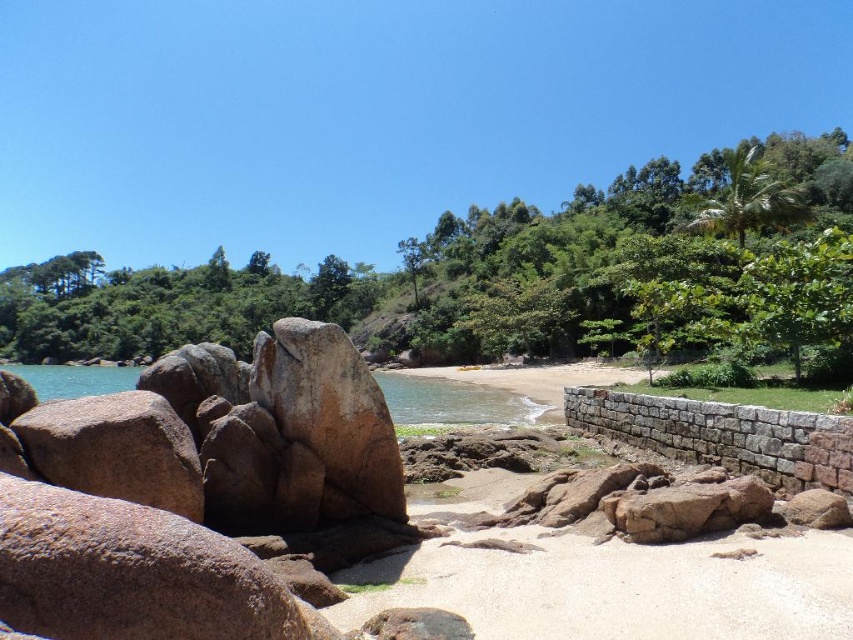
Does brown granite rock formation at center appear on the right side of clear blue water at center left?

Correct, you'll find brown granite rock formation at center to the right of clear blue water at center left.

Which of these two, brown granite rock formation at center or clear blue water at center left, stands shorter?

With less height is brown granite rock formation at center.

Who is more distant from viewer, (322, 504) or (129, 374)?

Point (129, 374)

Where is `brown granite rock formation at center`? brown granite rock formation at center is located at coordinates (192, 490).

Can you confirm if light brown sand at center is positioned below clear water at beach center?

Actually, light brown sand at center is above clear water at beach center.

Is point (764, 579) closer to camera compared to point (489, 413)?

Yes, point (764, 579) is closer to viewer.

At what (x,y) coordinates should I click in order to perform the action: click on light brown sand at center. Please return your answer as a coordinate pair (x, y). Image resolution: width=853 pixels, height=640 pixels. Looking at the image, I should click on (616, 584).

Does brown granite rock formation at center have a greater width compared to light brown sand at center?

Yes.

Based on the photo, between brown granite rock formation at center and light brown sand at center, which one is positioned higher?

brown granite rock formation at center is above.

Does point (132, 550) come in front of point (566, 540)?

Yes, it is in front of point (566, 540).

You are a GUI agent. You are given a task and a screenshot of the screen. Output one action in this format:
    pyautogui.click(x=<x>, y=<y>)
    Task: Click on the brown granite rock formation at center
    This screenshot has height=640, width=853.
    Given the screenshot: What is the action you would take?
    pyautogui.click(x=192, y=490)